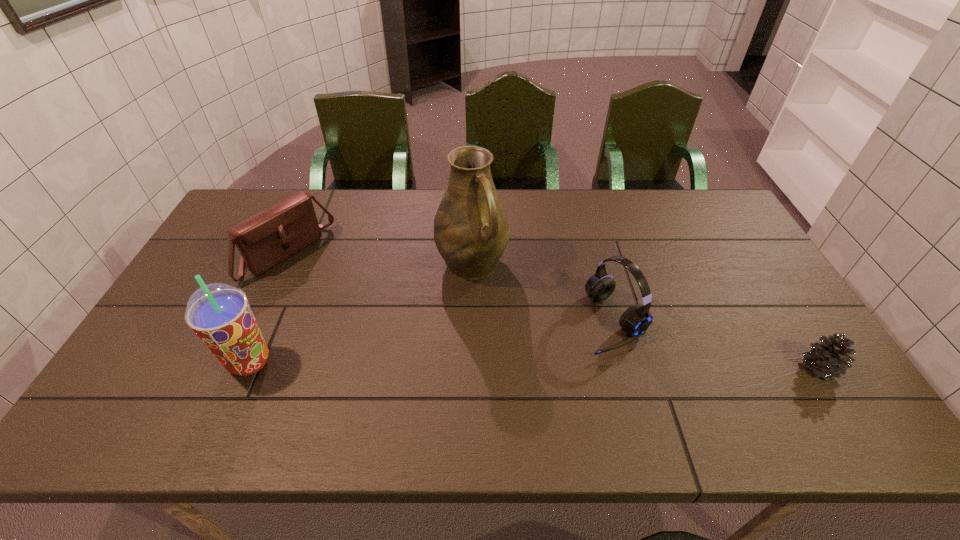
Where is `vacant space that's between the shoulder bag and the third object from left to right`? The height and width of the screenshot is (540, 960). vacant space that's between the shoulder bag and the third object from left to right is located at coordinates (380, 259).

At what (x,y) coordinates should I click in order to perform the action: click on unoccupied area between the headset and the shoulder bag. Please return your answer as a coordinate pair (x, y). Looking at the image, I should click on (451, 288).

At what (x,y) coordinates should I click in order to perform the action: click on unoccupied position between the fourth shortest object and the shoulder bag. Please return your answer as a coordinate pair (x, y). Looking at the image, I should click on (269, 308).

You are a GUI agent. You are given a task and a screenshot of the screen. Output one action in this format:
    pyautogui.click(x=<x>, y=<y>)
    Task: Click on the free spot between the second object from right to left and the second tallest object
    This screenshot has width=960, height=540.
    Given the screenshot: What is the action you would take?
    click(432, 342)

Where is `free spot between the pinecone and the second tallest object`? This screenshot has height=540, width=960. free spot between the pinecone and the second tallest object is located at coordinates (535, 365).

I want to click on free space between the pitcher and the smoothie, so click(x=361, y=313).

Find the location of a particular element. This screenshot has height=540, width=960. empty space that is in between the shoulder bag and the fourth object from left to right is located at coordinates (451, 288).

Identify the location of object that stands as the second closest to the pitcher. (267, 238).

Image resolution: width=960 pixels, height=540 pixels. In order to click on the closest object relative to the second tallest object in this screenshot , I will do `click(267, 238)`.

Locate an element on the screen. The height and width of the screenshot is (540, 960). free space that satisfies the following two spatial constraints: 1. on the front side of the second tallest object; 2. on the right side of the rightmost object is located at coordinates click(248, 368).